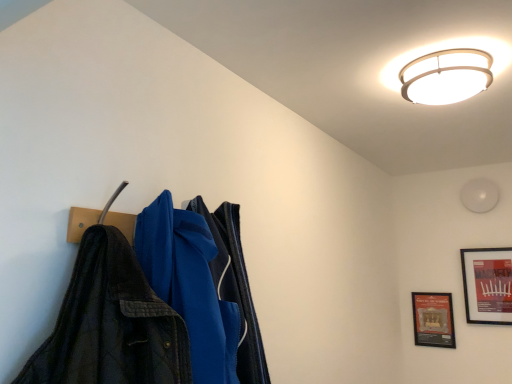
Question: In terms of width, does wooden framed poster at lower right, which appears as the 1th picture frame when viewed from the left, look wider or thinner when compared to matte black picture frame at upper right, which is the first picture frame from right to left?

Choices:
 (A) thin
 (B) wide

Answer: (A)

Question: Is wooden framed poster at lower right, which appears as the 2th picture frame when viewed from the right, to the left or to the right of matte black picture frame at upper right, positioned as the 2th picture frame in left-to-right order, in the image?

Choices:
 (A) left
 (B) right

Answer: (A)

Question: Based on their relative distances, which object is nearer to the matte black picture frame at upper right, positioned as the 2th picture frame in left-to-right order?

Choices:
 (A) white glossy ceiling light at upper center
 (B) white matte light fixture at upper right
 (C) wooden framed poster at lower right, which appears as the 1th picture frame when viewed from the left

Answer: (C)

Question: Which object is the closest to the wooden framed poster at lower right, which appears as the 1th picture frame when viewed from the left?

Choices:
 (A) white glossy ceiling light at upper center
 (B) matte black picture frame at upper right, positioned as the 2th picture frame in left-to-right order
 (C) white matte light fixture at upper right

Answer: (B)